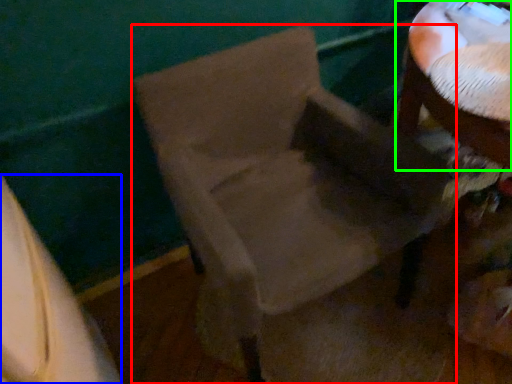
Question: Which is farther away from chair (highlighted by a red box)? leftover (highlighted by a blue box) or table (highlighted by a green box)?

Choices:
 (A) leftover
 (B) table

Answer: (A)